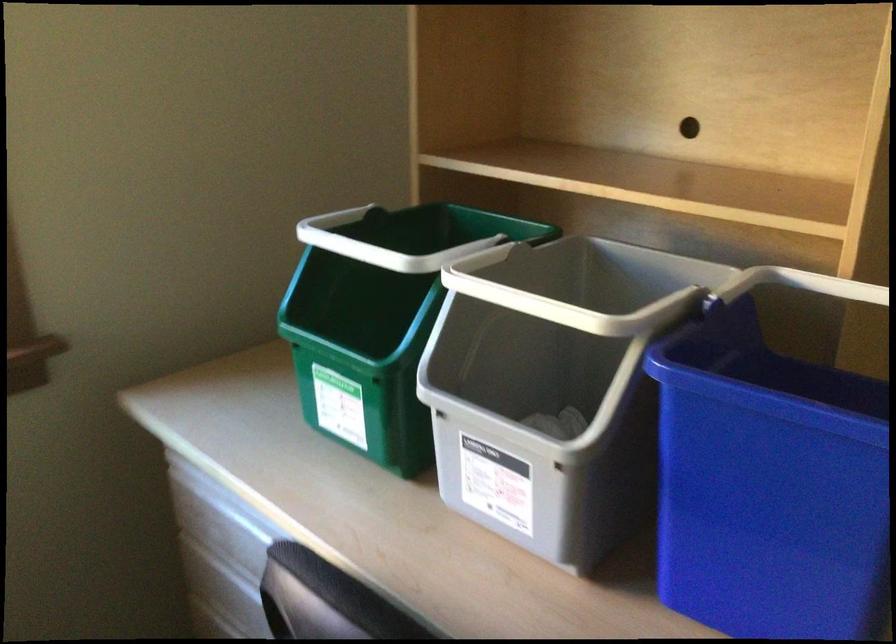
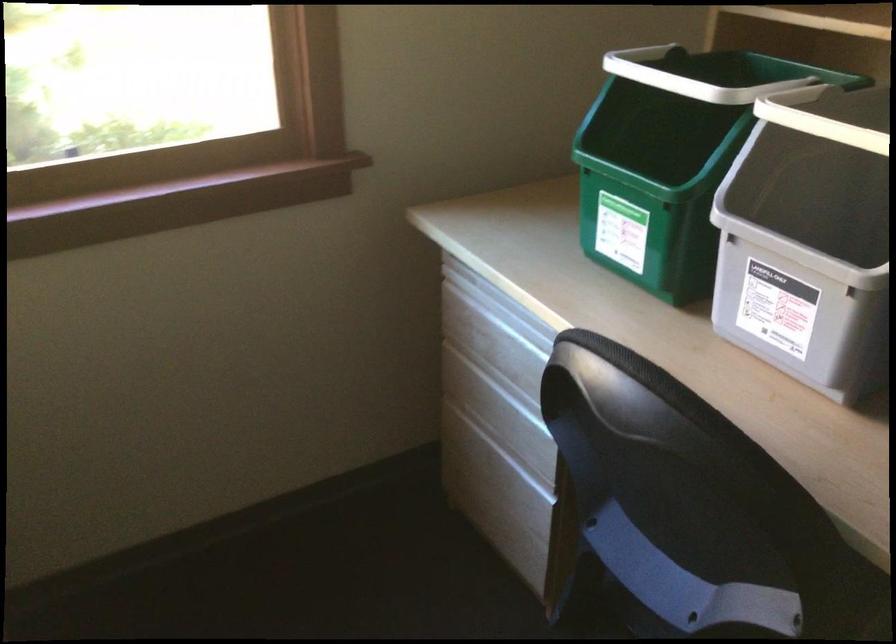
Locate, in the second image, the point that corresponds to (x=504, y=430) in the first image.

(797, 250)